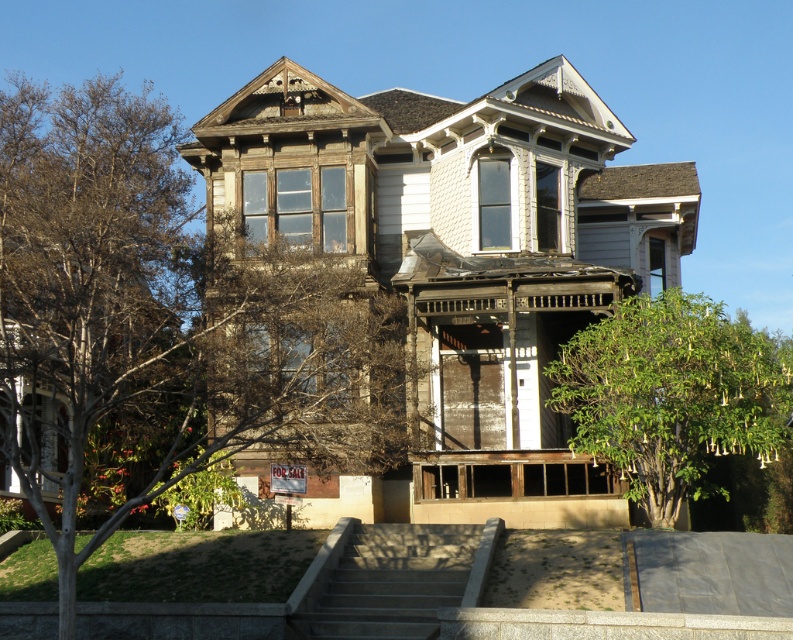
Question: Does bare wood tree at center have a lesser width compared to green leafy tree at lower right?

Choices:
 (A) no
 (B) yes

Answer: (A)

Question: Which point appears farthest from the camera in this image?

Choices:
 (A) (579, 333)
 (B) (60, 496)

Answer: (B)

Question: Is bare wood tree at center behind green leafy tree at lower right?

Choices:
 (A) yes
 (B) no

Answer: (B)

Question: Does green leafy tree at lower right appear on the right side of gray concrete stairs at center?

Choices:
 (A) no
 (B) yes

Answer: (B)

Question: Estimate the real-world distances between objects in this image. Which object is farther from the green leafy tree at lower right?

Choices:
 (A) bare wood tree at center
 (B) gray concrete stairs at center

Answer: (A)

Question: Which of the following is the farthest from the observer?

Choices:
 (A) (244, 268)
 (B) (707, 394)
 (C) (351, 595)

Answer: (B)